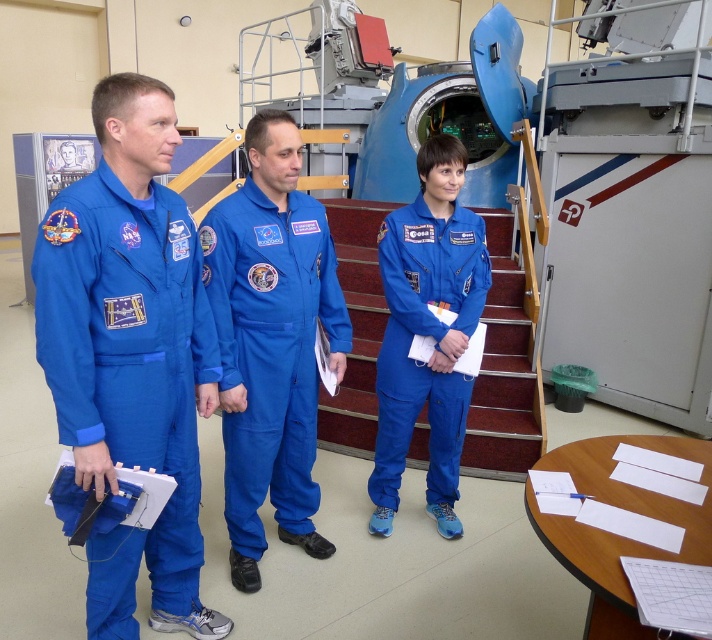
Can you confirm if blue smooth jumpsuit at center is positioned below maroon carpeted stairs at center?

Indeed, blue smooth jumpsuit at center is positioned under maroon carpeted stairs at center.

Does blue smooth jumpsuit at center have a greater width compared to maroon carpeted stairs at center?

Incorrect, blue smooth jumpsuit at center's width does not surpass maroon carpeted stairs at center's.

Is point (258, 152) closer to viewer compared to point (502, 374)?

Yes, point (258, 152) is closer to viewer.

Identify the location of blue smooth jumpsuit at center. (271, 340).

Is blue fabric jumpsuit at center smaller than maroon carpeted stairs at center?

Yes.

Is blue fabric jumpsuit at center positioned in front of maroon carpeted stairs at center?

Yes, it is in front of maroon carpeted stairs at center.

Is point (449, 515) farther from viewer compared to point (511, 275)?

No, it is not.

This screenshot has width=712, height=640. In order to click on blue fabric jumpsuit at center in this screenshot , I will do `click(426, 332)`.

Does matte blue jumpsuit at left appear on the right side of blue fabric jumpsuit at center?

In fact, matte blue jumpsuit at left is to the left of blue fabric jumpsuit at center.

Can you confirm if matte blue jumpsuit at left is positioned above blue fabric jumpsuit at center?

Actually, matte blue jumpsuit at left is below blue fabric jumpsuit at center.

Is point (155, 584) closer to camera compared to point (413, 298)?

Yes.

Where is `matte blue jumpsuit at left`? Image resolution: width=712 pixels, height=640 pixels. matte blue jumpsuit at left is located at coordinates (130, 353).